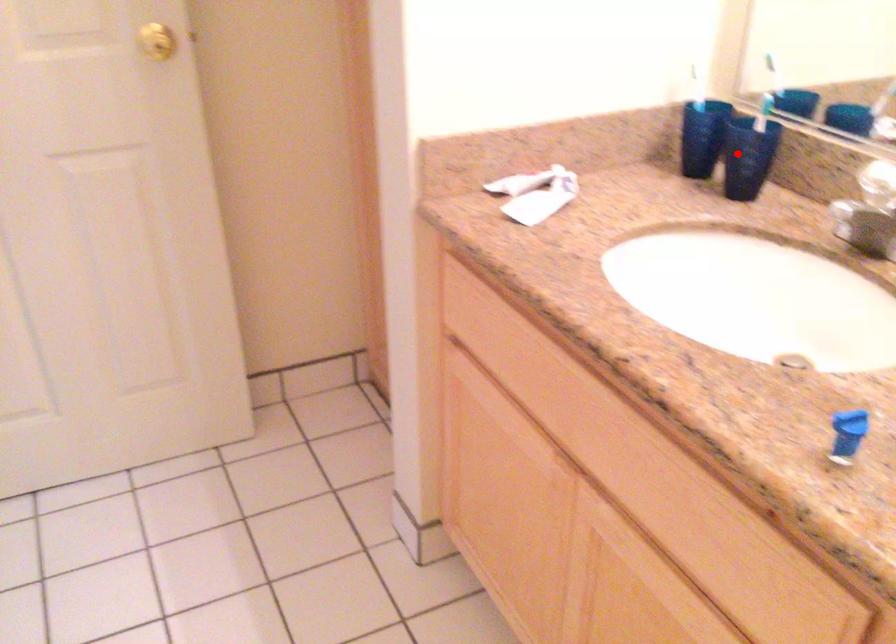
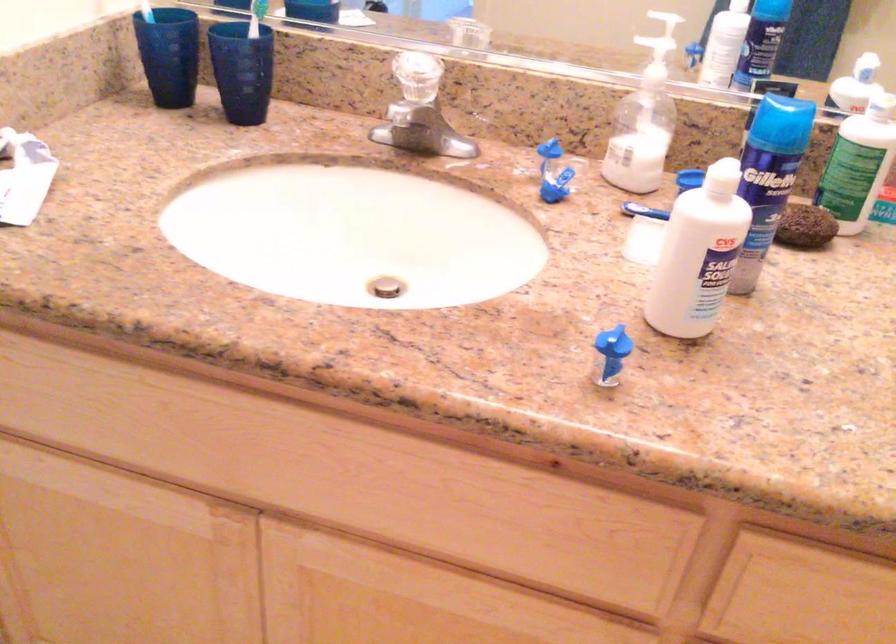
Locate, in the second image, the point that corresponds to the highlighted location in the first image.

(242, 70)